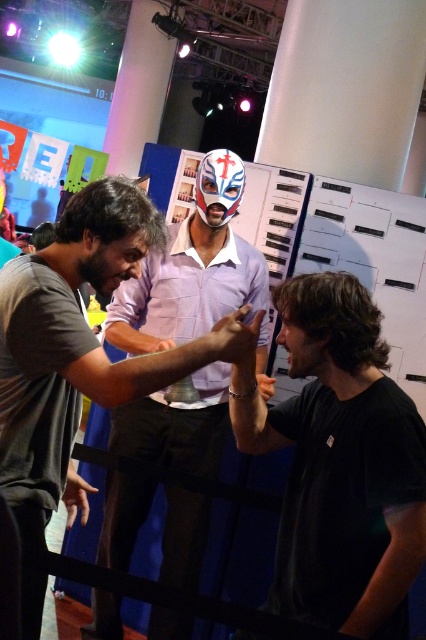
Which is behind, point (354, 486) or point (199, 218)?

Point (199, 218)

In order to click on black matte shirt at center in this screenshot , I will do `click(339, 461)`.

Describe the element at coordinates (339, 461) in the screenshot. I see `black matte shirt at center` at that location.

You are a GUI agent. You are given a task and a screenshot of the screen. Output one action in this format:
    pyautogui.click(x=<x>, y=<y>)
    Task: Click on the black matte shirt at center
    The width and height of the screenshot is (426, 640).
    Given the screenshot: What is the action you would take?
    pyautogui.click(x=339, y=461)